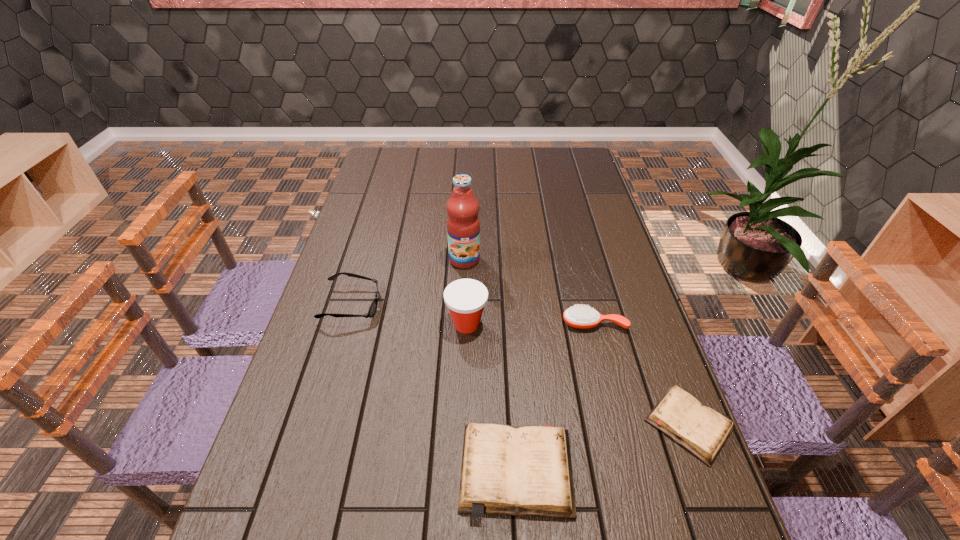
Identify the location of vacant place for an extra diary on the left. (314, 525).